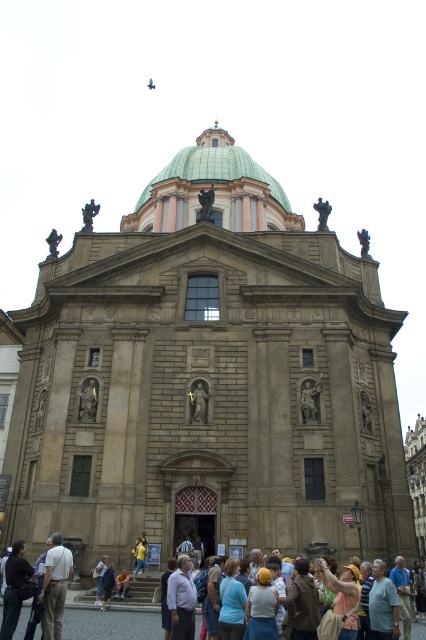
Question: Is dark brown leather jacket at lower left thinner than blue fabric shirt at lower right?

Choices:
 (A) no
 (B) yes

Answer: (B)

Question: Does green glazed dome at upper center have a lesser width compared to yellow fabric headscarf at center?

Choices:
 (A) yes
 (B) no

Answer: (B)

Question: Which point is farther to the camera?

Choices:
 (A) (400, 608)
 (B) (11, 573)

Answer: (A)

Question: From the image, what is the correct spatial relationship of dark brown leather jacket at lower left in relation to blue cotton shirt at lower center?

Choices:
 (A) left
 (B) right

Answer: (A)

Question: Which of these objects is positioned closest to the light blue shirt at center?

Choices:
 (A) green glazed dome at upper center
 (B) light brown leather jacket at lower right

Answer: (B)

Question: Which point is closer to the camera?

Choices:
 (A) dark brown leather jacket at lower left
 (B) blue cotton shirt at lower center
 (C) gray fabric shirt at lower right
 (D) light brown leather jacket at lower right

Answer: (D)